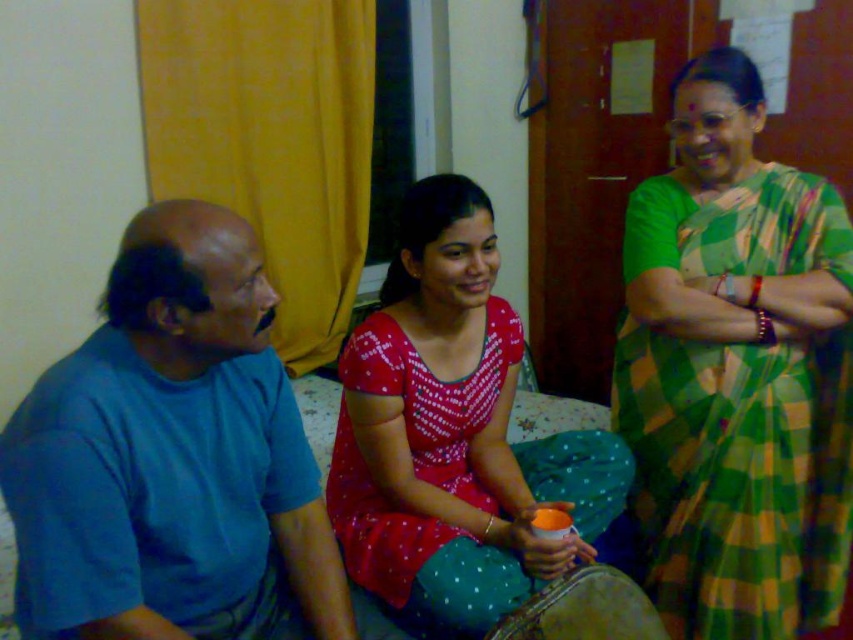
You are a photographer taking a picture of the scene. You notice two points marked as point 1 at coordinates (709, 516) and point 2 at (425, 556). Which point is closer to the camera?

Point 2 at coordinates (425, 556) is closer to the camera than point 1 at (709, 516).

You are standing in the room and want to hand the green checkered saree at right to someone. If you extend your arm fully, which is about 2.5 feet long, can you reach it without moving?

The green checkered saree at right is 5.08 feet away from the viewer. Since your arm is only 2.5 feet long, you cannot reach it without moving closer.

In the scene described, there is a green checkered saree at right and a blue cotton shirt at left. Which of these two items is positioned farther to the right side of the image?

The green checkered saree at right is positioned farther to the right side of the image than the blue cotton shirt at left.